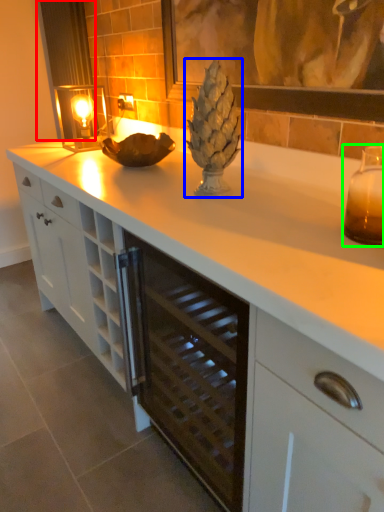
Question: Which object is positioned farthest from curtain (highlighted by a red box)? Select from pineapple (highlighted by a blue box) and candle holder (highlighted by a green box).

Choices:
 (A) pineapple
 (B) candle holder

Answer: (B)